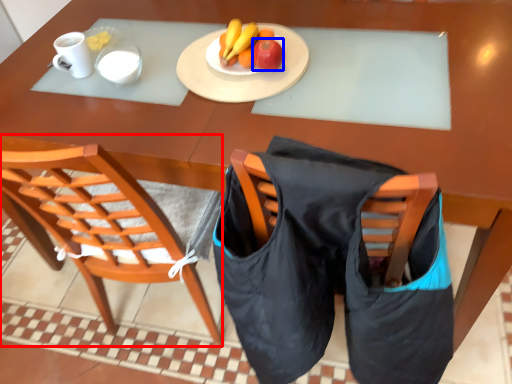
Question: Which of the following is the closest to the observer, chair (highlighted by a red box) or apple (highlighted by a blue box)?

Choices:
 (A) chair
 (B) apple

Answer: (A)